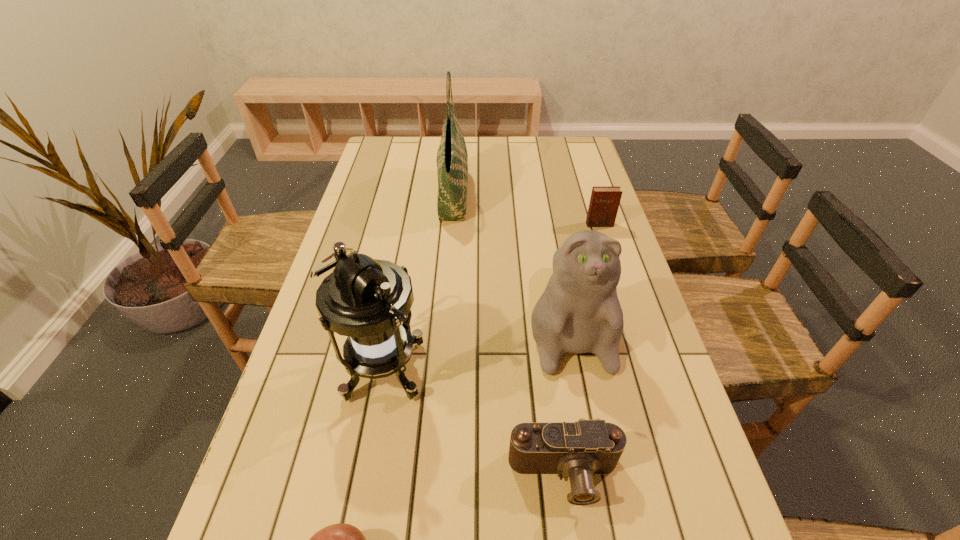
The height and width of the screenshot is (540, 960). I want to click on tote bag, so click(x=452, y=158).

Find the location of a particular element. Image resolution: width=960 pixels, height=540 pixels. lantern is located at coordinates (365, 299).

At what (x,y) coordinates should I click in order to perform the action: click on the fourth shortest object. Please return your answer as a coordinate pair (x, y). Image resolution: width=960 pixels, height=540 pixels. Looking at the image, I should click on (579, 312).

Locate an element on the screen. This screenshot has height=540, width=960. the third shortest object is located at coordinates (604, 202).

Locate an element on the screen. This screenshot has width=960, height=540. the rightmost object is located at coordinates (604, 202).

The image size is (960, 540). In order to click on the fifth tallest object in this screenshot , I will do [x=579, y=449].

At what (x,y) coordinates should I click in order to perform the action: click on camera. Please return your answer as a coordinate pair (x, y). Image resolution: width=960 pixels, height=540 pixels. Looking at the image, I should click on (579, 449).

In order to click on blank space located 0.240m on the right of the tote bag in this screenshot , I will do `click(541, 194)`.

I want to click on vacant point located on the right of the lantern, so click(586, 366).

In order to click on free region located 0.280m on the face of the cat in this screenshot , I will do `click(608, 519)`.